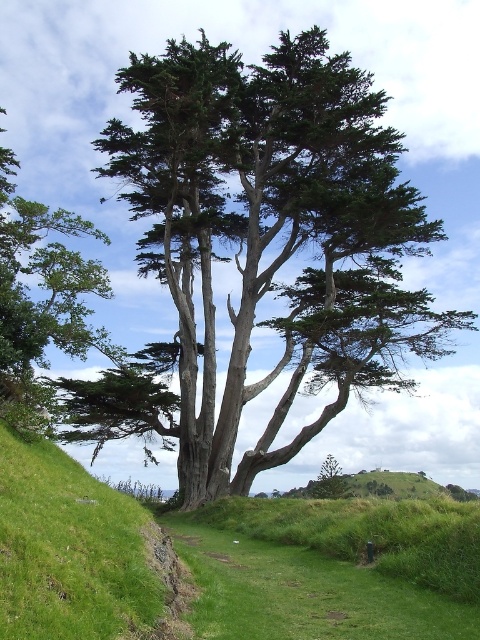
Between green grassy at lower center and green rough bark tree at upper center, which one has less height?

green grassy at lower center is shorter.

Can you confirm if green grassy at lower center is positioned to the left of green rough bark tree at upper center?

In fact, green grassy at lower center is to the right of green rough bark tree at upper center.

Does point (399, 573) come behind point (62, 336)?

That is False.

You are a GUI agent. You are given a task and a screenshot of the screen. Output one action in this format:
    pyautogui.click(x=<x>, y=<y>)
    Task: Click on the green grassy at lower center
    The width and height of the screenshot is (480, 640).
    Given the screenshot: What is the action you would take?
    pyautogui.click(x=332, y=568)